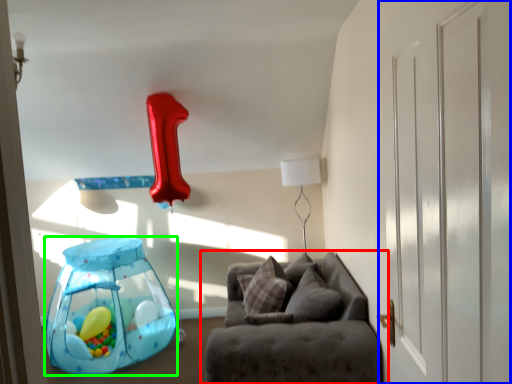
Question: Estimate the real-world distances between objects in this image. Which object is closer to studio couch (highlighted by a red box), glass door (highlighted by a blue box) or balloon (highlighted by a green box)?

Choices:
 (A) glass door
 (B) balloon

Answer: (A)